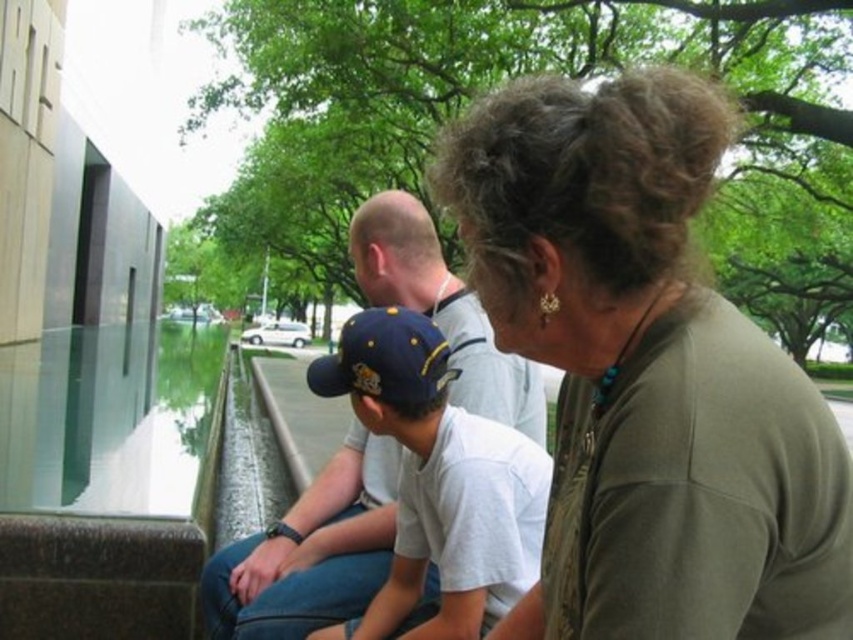
Question: Is matte blue cap at center positioned behind navy blue fabric baseball cap at center?

Choices:
 (A) no
 (B) yes

Answer: (A)

Question: Which point appears closest to the camera in this image?

Choices:
 (A) (827, 493)
 (B) (422, 499)
 (C) (397, 364)

Answer: (A)

Question: Does matte blue cap at center appear under navy blue fabric baseball cap at center?

Choices:
 (A) no
 (B) yes

Answer: (B)

Question: Can you confirm if matte olive green shirt at center is positioned below matte blue cap at center?

Choices:
 (A) yes
 (B) no

Answer: (B)

Question: Which object appears farthest from the camera in this image?

Choices:
 (A) matte blue cap at center
 (B) matte olive green shirt at center
 (C) navy blue fabric baseball cap at center

Answer: (C)

Question: Considering the real-world distances, which object is closest to the matte olive green shirt at center?

Choices:
 (A) navy blue fabric baseball cap at center
 (B) matte blue cap at center

Answer: (B)